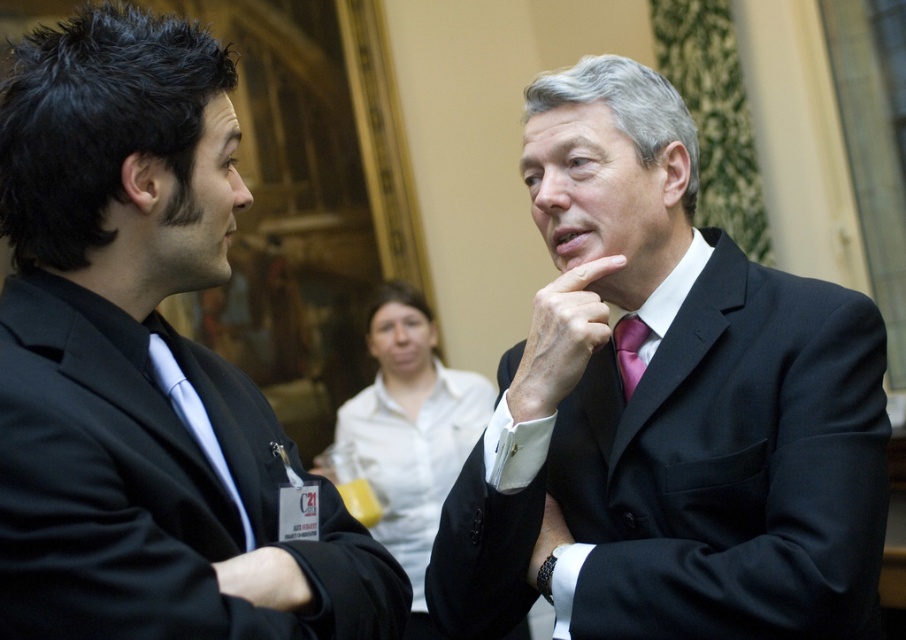
You are a photographer standing in front of the black suit at center. You want to take a photo of it from a distance that ensures it fills the frame without being too close. The ideal distance for this is 1.5 meters. Is the current distance sufficient?

The black suit at center is currently 1.39 meters away from the camera, which is closer than the ideal 1.5 meters. To achieve the desired framing, you should move back slightly to increase the distance to 1.5 meters.

You are attending a formal event and notice two items of clothing in the scene. The matte black suit at left and the pink satin tie at center. Which item appears larger in height?

The matte black suit at left is taller than the pink satin tie at center, so the matte black suit at left appears larger in height.

In the scene where two people are talking, you need to determine which object is taller between the black suit at center and the smooth skin hand at center. Which one is taller?

The black suit at center is much taller as smooth skin hand at center.